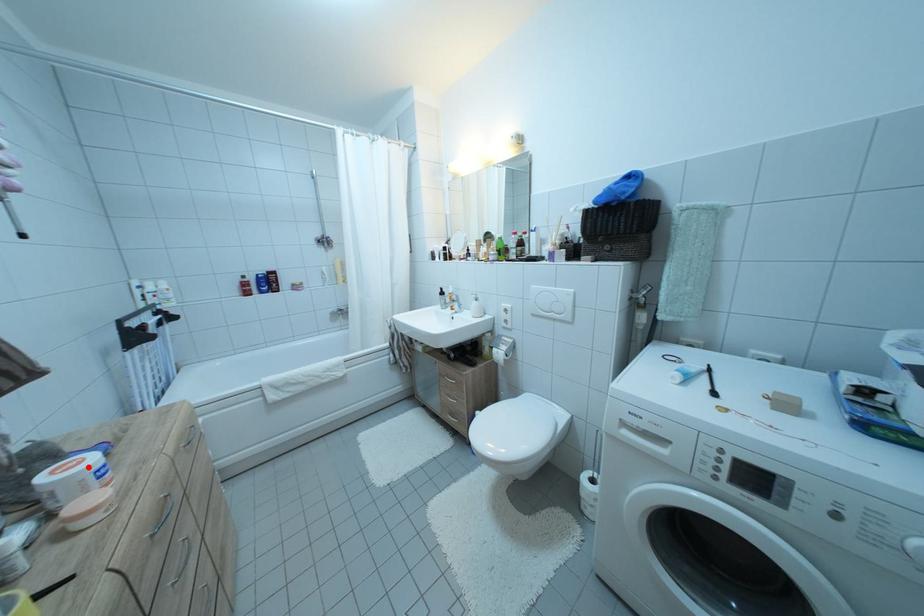
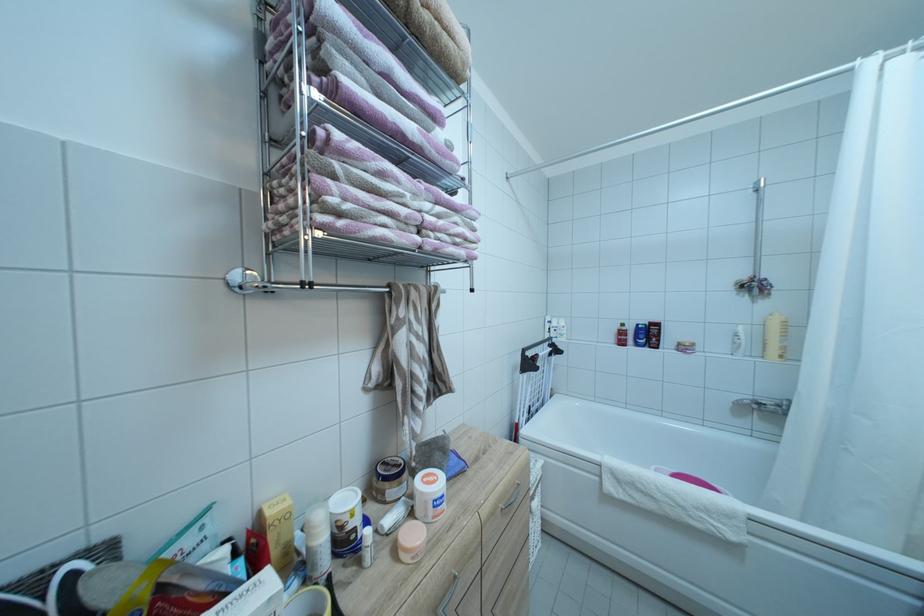
The point at the highlighted location is marked in the first image. Where is the corresponding point in the second image?

(442, 487)